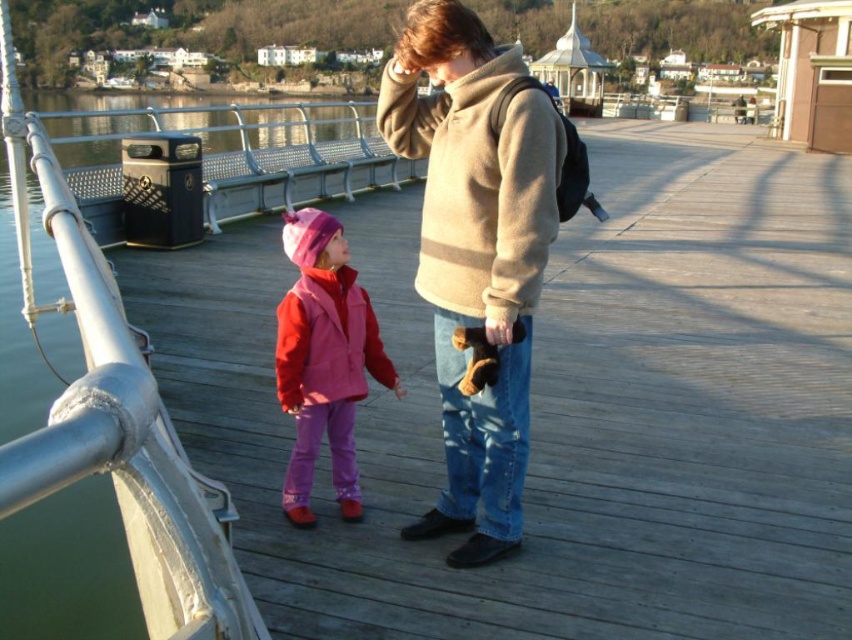
You are a photographer trying to capture a clear shot of the pink fleece jacket at center without the beige woolen sweater at center blocking it. What should you do?

Move the camera position so that the beige woolen sweater at center is no longer in front of the pink fleece jacket at center. Since the beige woolen sweater at center is currently in front, adjusting your angle or moving closer could help isolate the pink fleece jacket at center in the frame.

You are a photographer trying to capture the beige woolen sweater at center in your shot. If your camera has a 50mm lens with a field of view of 46 degrees, what is the maximum distance you can be from the sweater to ensure it fits entirely within the frame?

The beige woolen sweater at center is located at coordinates (476, 252). To calculate the maximum distance, use the formula distance equals sweater width divided by tangent of half the field of view angle multiplied by two. Assuming the sweater width is known, this would determine the required distance. However, without specific dimensions, an exact numerical answer cannot be provided.